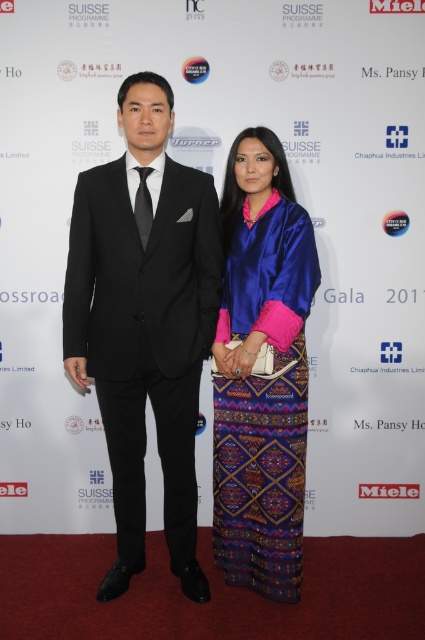
Question: Which of the following is the closest to the observer?

Choices:
 (A) (198, 593)
 (B) (231, 230)

Answer: (A)

Question: Does black satin suit at left appear under silky blue dress at center?

Choices:
 (A) no
 (B) yes

Answer: (A)

Question: Can you confirm if black satin suit at left is positioned to the right of silky blue dress at center?

Choices:
 (A) no
 (B) yes

Answer: (A)

Question: Is black satin suit at left positioned in front of silky blue dress at center?

Choices:
 (A) yes
 (B) no

Answer: (A)